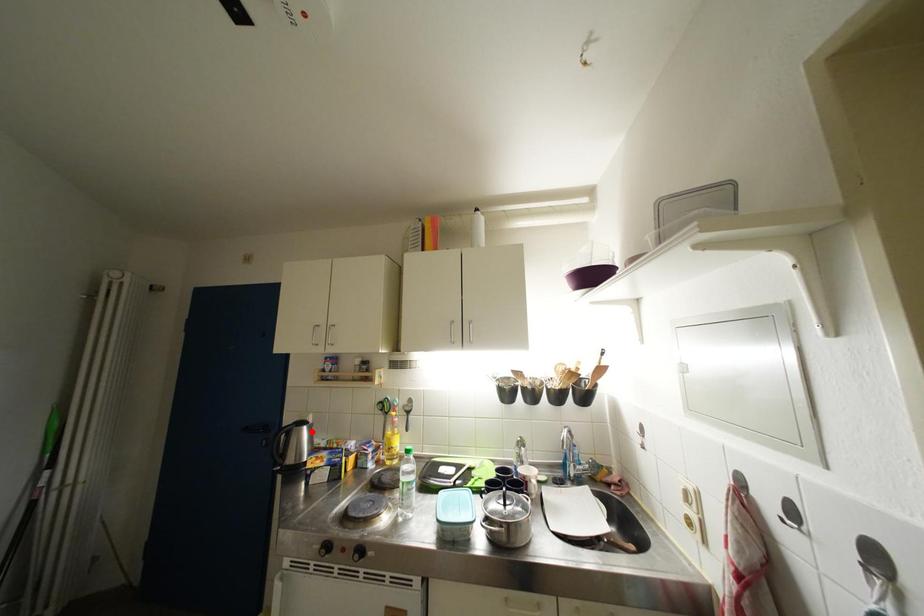
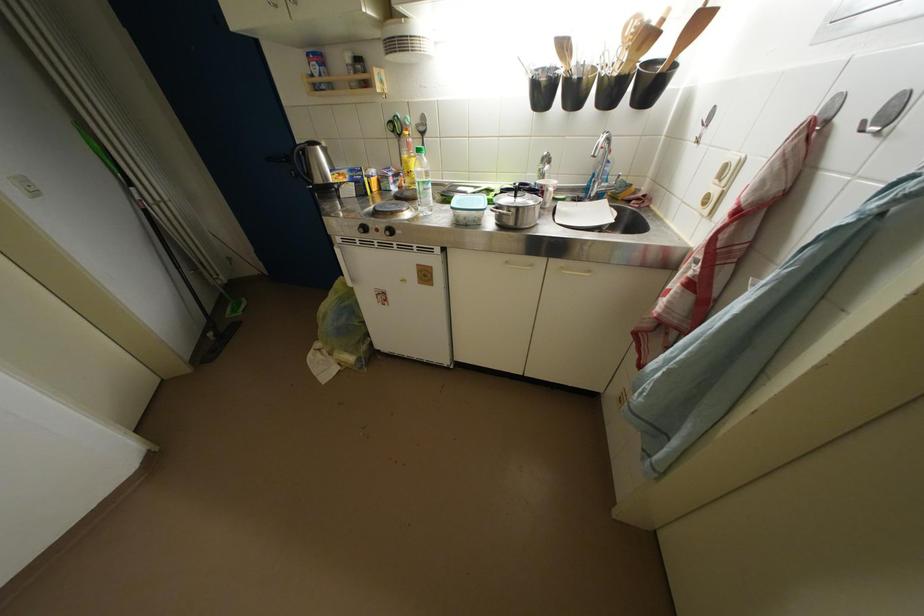
The point at the highlighted location is marked in the first image. Where is the corresponding point in the second image?

(324, 152)